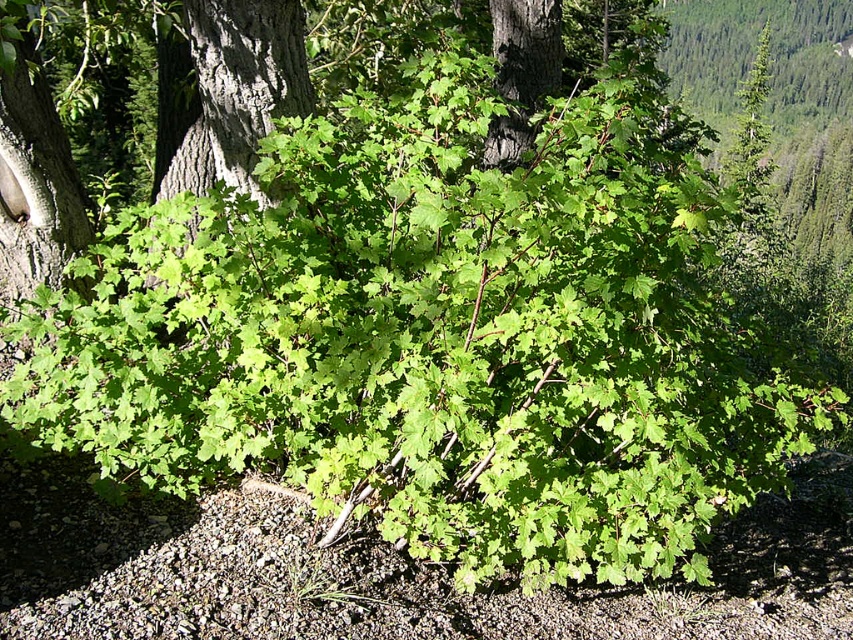
You are a botanist examining two tree trunks in a forest. You see the smooth gray bark at center and the dark brown bark at center. Which one has a bigger circumference?

The smooth gray bark at center has a larger size compared to the dark brown bark at center, so it has a bigger circumference.

You are a botanist examining two tree trunks in a forest. You see the smooth gray bark at center and the dark brown bark at center. Which trunk has a wider girth?

The smooth gray bark at center has a larger width than the dark brown bark at center, so the smooth gray bark at center trunk has a wider girth.